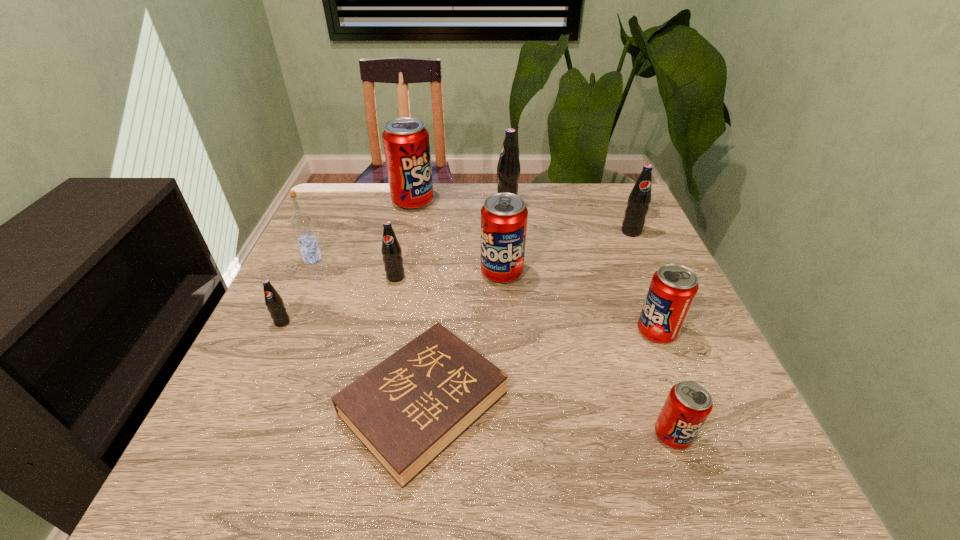
This screenshot has width=960, height=540. What are the coordinates of `vacant space that is in between the third smallest red soda can and the third farthest object` in the screenshot? It's located at (566, 252).

The height and width of the screenshot is (540, 960). Identify the location of vacant space in between the nearest soda can and the third farthest black pop. (534, 356).

Choose which object is the fifth nearest neighbor to the nearest red soda can. Please provide its 2D coordinates. Your answer should be formatted as a tuple, i.e. [(x, y)], where the tuple contains the x and y coordinates of a point satisfying the conditions above.

[(391, 251)]

Identify which object is the nearest to the third farthest red soda can. Please provide its 2D coordinates. Your answer should be formatted as a tuple, i.e. [(x, y)], where the tuple contains the x and y coordinates of a point satisfying the conditions above.

[(689, 403)]

Identify the location of the seventh closest soda can to the sixth nearest soda can. This screenshot has width=960, height=540. (273, 301).

This screenshot has height=540, width=960. Identify the location of soda can that is the third closest to the blue vodka. (406, 143).

Identify which red soda can is located as the second nearest to the third farthest red soda can. Please provide its 2D coordinates. Your answer should be formatted as a tuple, i.e. [(x, y)], where the tuple contains the x and y coordinates of a point satisfying the conditions above.

[(504, 216)]

Locate which red soda can ranks in proximity to the third smallest red soda can. Please provide its 2D coordinates. Your answer should be formatted as a tuple, i.e. [(x, y)], where the tuple contains the x and y coordinates of a point satisfying the conditions above.

[(673, 287)]

The image size is (960, 540). In order to click on black pop that can be found as the third closest to the third farthest black pop in this screenshot , I will do `click(639, 199)`.

The width and height of the screenshot is (960, 540). What are the coordinates of `black pop that is the closest to the leftmost soda can` in the screenshot? It's located at (391, 251).